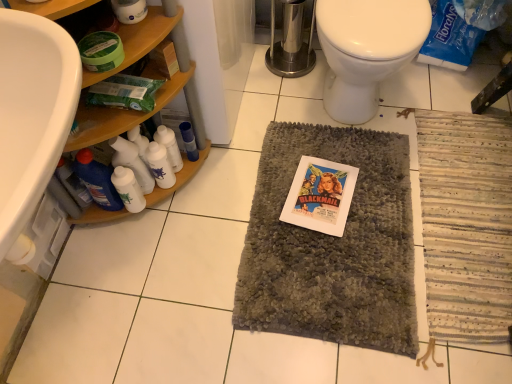
Find the location of a particular element. This screenshot has height=384, width=512. vacant area that lies between white glossy bottle at lower left, the second bottle in the left-to-right sequence, and striped fabric bath mat at lower right is located at coordinates (315, 234).